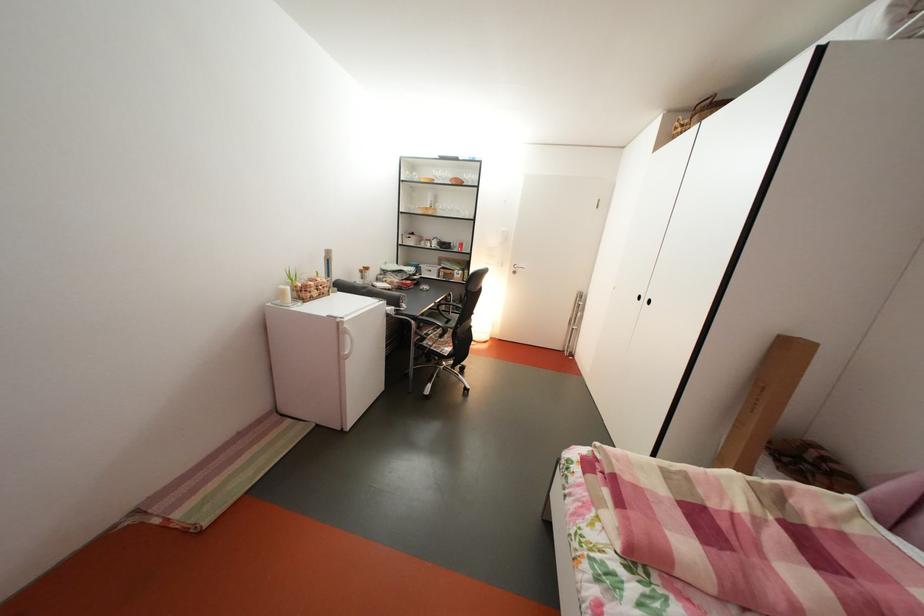
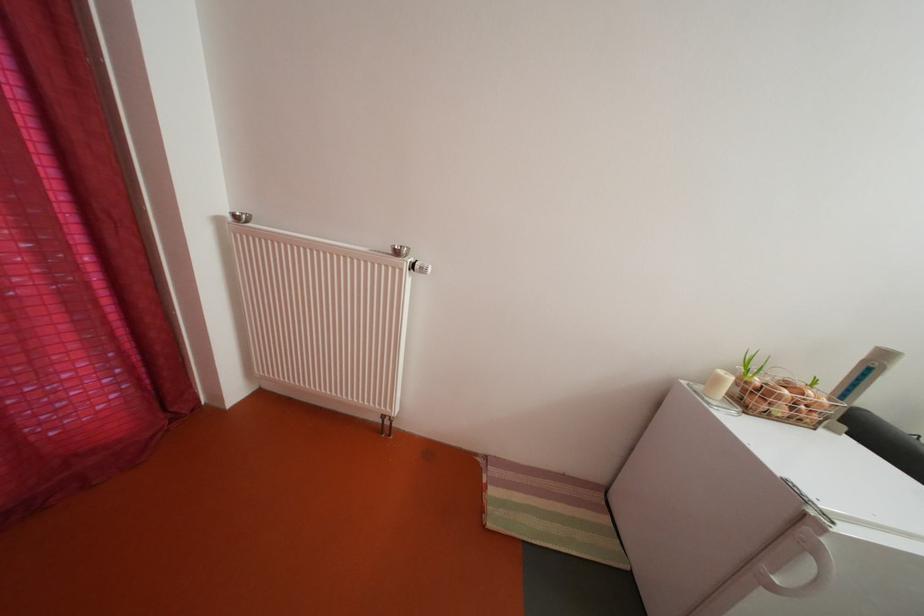
Question: The camera is either moving clockwise (left) or counter-clockwise (right) around the object. The first image is from the beginning of the video and the second image is from the end. Is the camera moving left or right when shooting the video?

Choices:
 (A) Left
 (B) Right

Answer: (B)